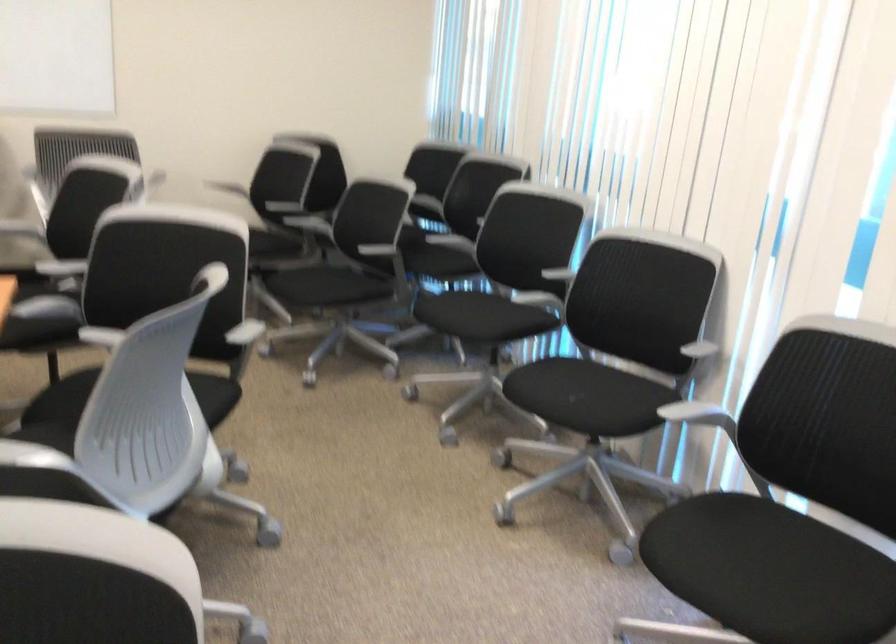
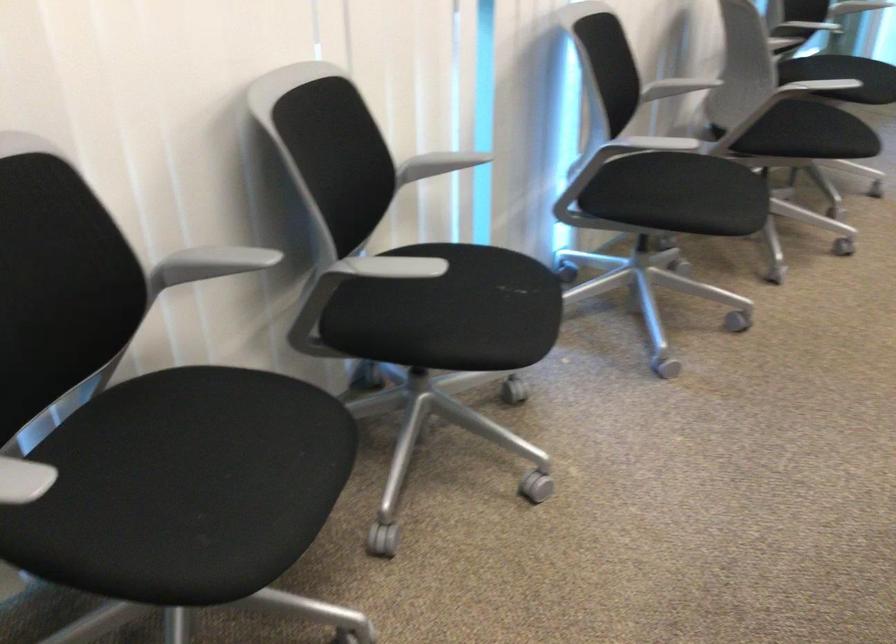
Find the pixel in the second image that matches point 471,314 in the first image.

(226, 456)